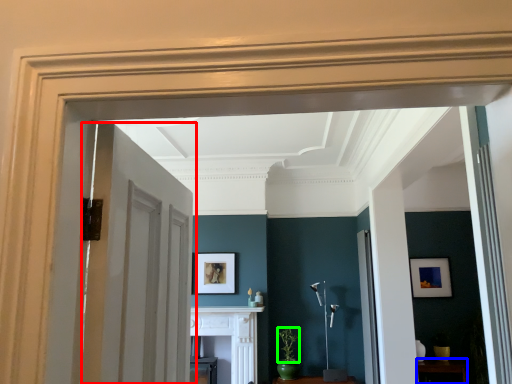
Question: Which object is positioned farthest from door (highlighted by a red box)? Select from furniture (highlighted by a blue box) and plant (highlighted by a green box).

Choices:
 (A) furniture
 (B) plant

Answer: (A)